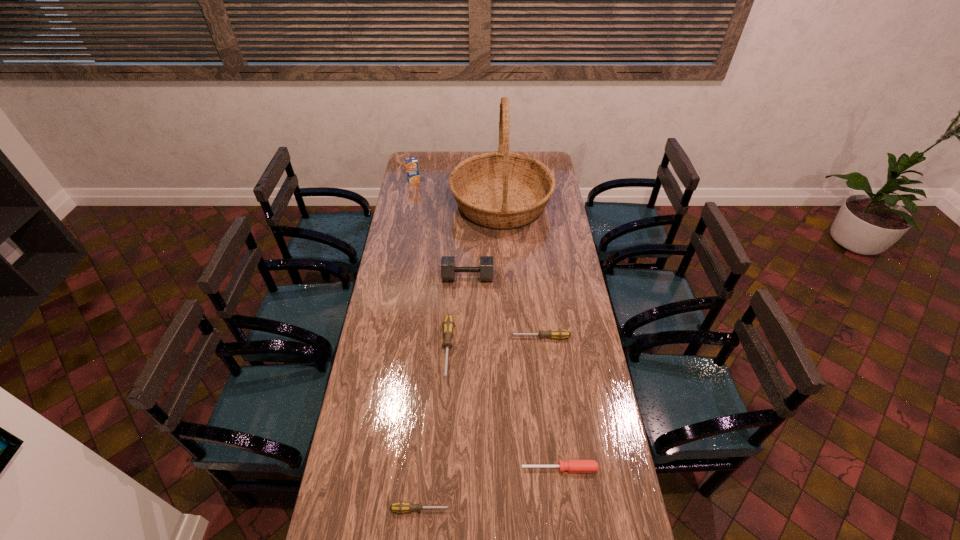
You are a GUI agent. You are given a task and a screenshot of the screen. Output one action in this format:
    pyautogui.click(x=<x>, y=<y>)
    Task: Click on the free space that satisfies the following two spatial constraints: 1. at the tip of the second tallest screwdriver; 2. on the right side of the third farthest screwdriver
    The width and height of the screenshot is (960, 540).
    Given the screenshot: What is the action you would take?
    pyautogui.click(x=555, y=468)